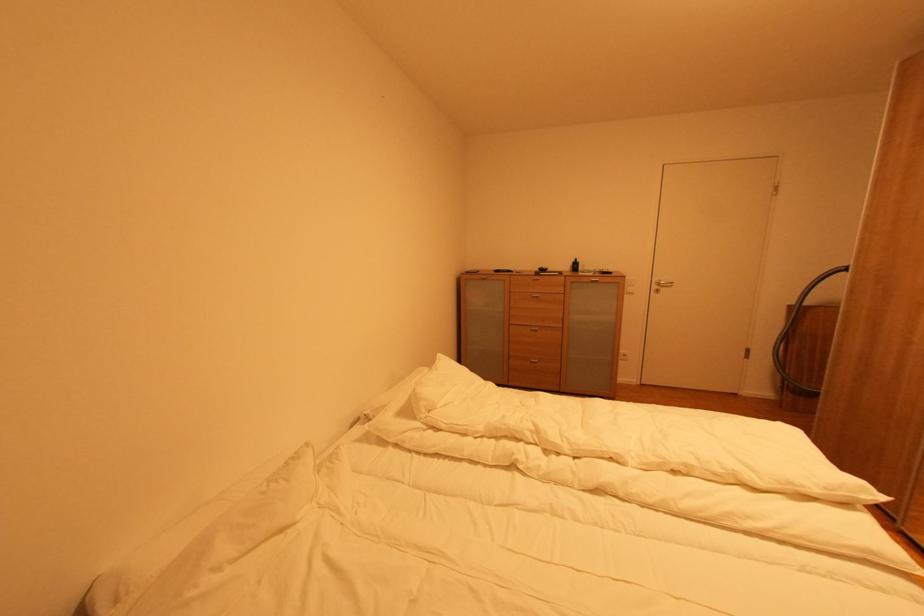
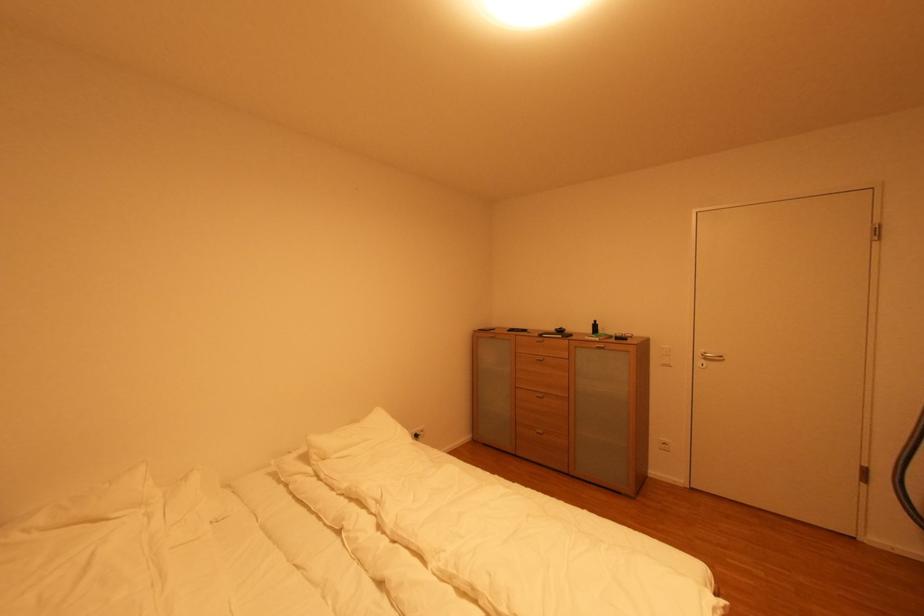
In the second image, find the point that corresponds to (x=661, y=289) in the first image.

(706, 362)